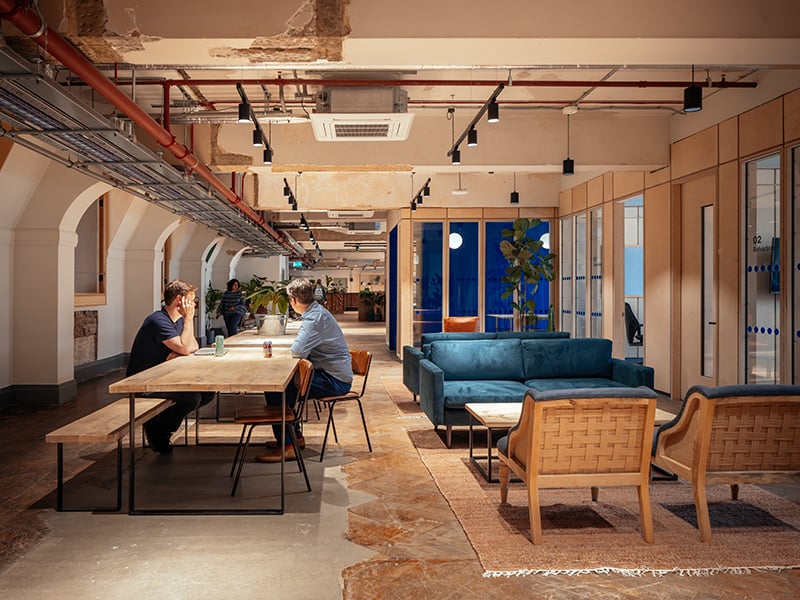
Find the location of a particular element. The width and height of the screenshot is (800, 600). bench is located at coordinates (85, 433).